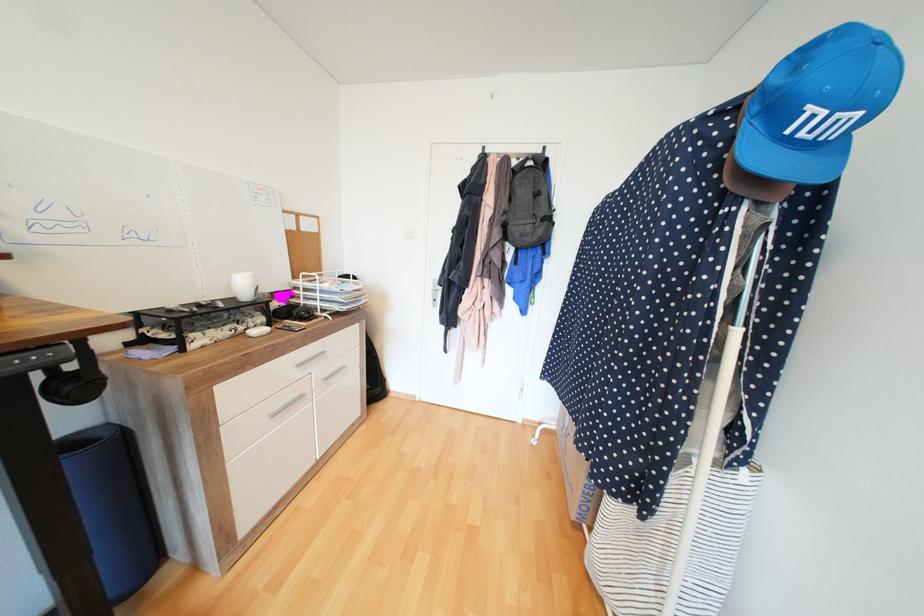
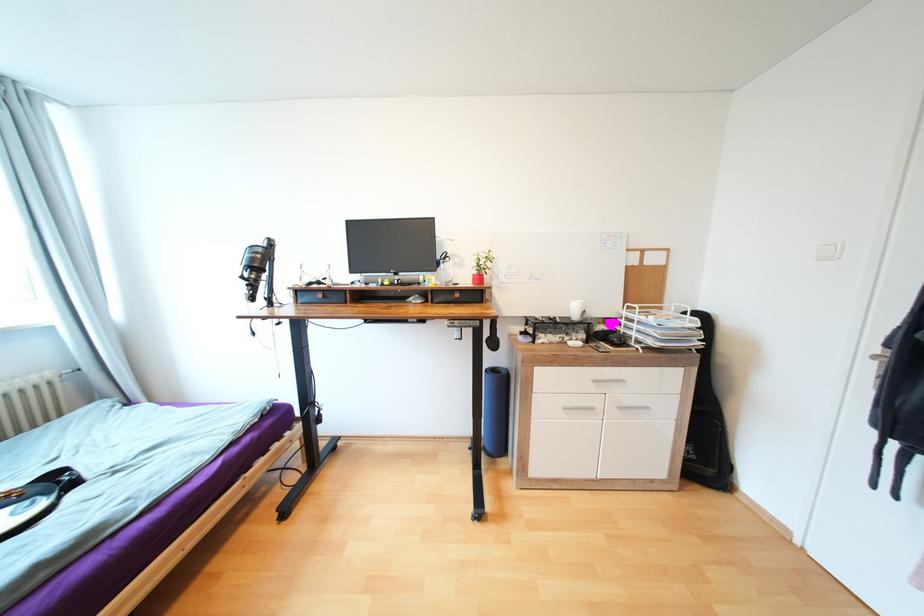
Question: Based on the continuous images, in which direction is the camera rotating? Reply with the corresponding letter.

Choices:
 (A) Left
 (B) Right
 (C) Up
 (D) Down

Answer: (A)